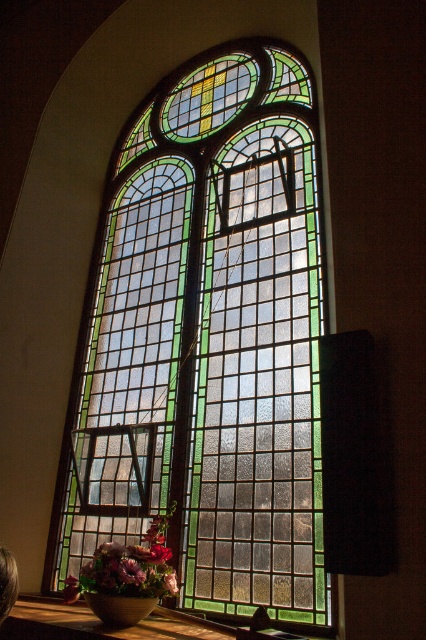
Is point (229, 330) farther from camera compared to point (150, 595)?

Yes, point (229, 330) is farther from viewer.

Which is above, stained glass window at center or matte floral arrangement at lower left?

stained glass window at center

Locate an element on the screen. stained glass window at center is located at coordinates (207, 340).